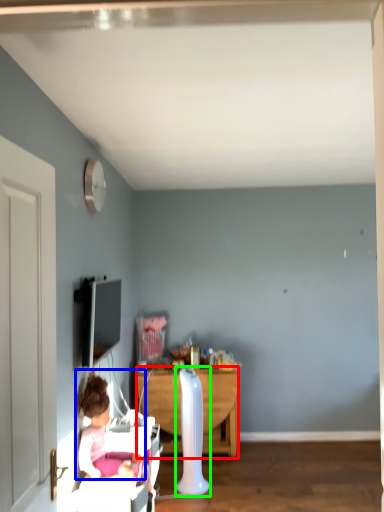
Question: Based on their relative distances, which object is farther from desk (highlighted by a red box)? Choose from person (highlighted by a blue box) and radiator (highlighted by a green box).

Choices:
 (A) person
 (B) radiator

Answer: (A)